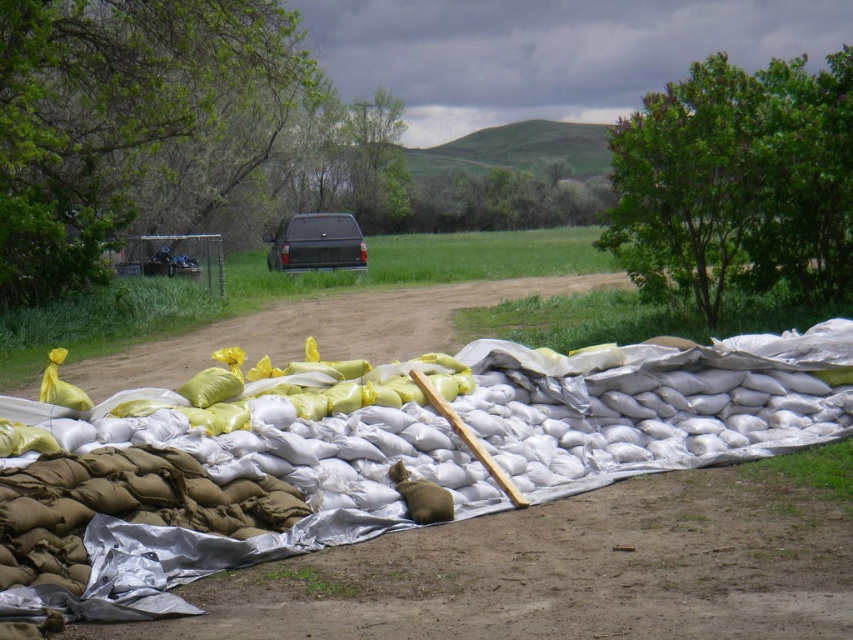
Does point (614, 387) come in front of point (358, 264)?

Yes, it is.

Can you confirm if white sandbags at center is bigger than matte black truck at center?

Actually, white sandbags at center might be smaller than matte black truck at center.

Is point (518, 385) positioned in front of point (270, 259)?

That is True.

Identify the location of white sandbags at center. This screenshot has width=853, height=640. (209, 492).